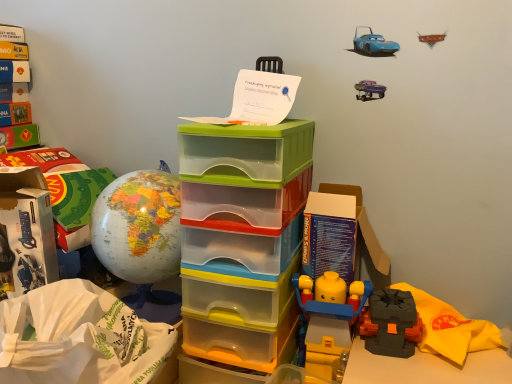
Question: From a real-world perspective, is matte black lego piece at lower right on top of translucent plastic storage box at center, positioned as the 2th storage box in left-to-right order?

Choices:
 (A) no
 (B) yes

Answer: (A)

Question: Is matte black lego piece at lower right to the left of translucent plastic storage box at center, positioned as the 2th storage box in left-to-right order, from the viewer's perspective?

Choices:
 (A) yes
 (B) no

Answer: (B)

Question: From a real-world perspective, is matte black lego piece at lower right positioned under translucent plastic storage box at center, arranged as the 1th storage box when viewed from the right, based on gravity?

Choices:
 (A) no
 (B) yes

Answer: (B)

Question: Is matte black lego piece at lower right thinner than translucent plastic storage box at center, arranged as the 1th storage box when viewed from the right?

Choices:
 (A) no
 (B) yes

Answer: (B)

Question: Would you say matte black lego piece at lower right is outside translucent plastic storage box at center, positioned as the 2th storage box in left-to-right order?

Choices:
 (A) yes
 (B) no

Answer: (A)

Question: Considering the positions of white cardboard box at left, marked as the second storage box in a right-to-left arrangement, and white paper bag at lower left in the image, is white cardboard box at left, marked as the second storage box in a right-to-left arrangement, bigger or smaller than white paper bag at lower left?

Choices:
 (A) big
 (B) small

Answer: (B)

Question: Is white cardboard box at left, marked as the second storage box in a right-to-left arrangement, in front of or behind white paper bag at lower left in the image?

Choices:
 (A) behind
 (B) front

Answer: (A)

Question: Does point (24, 195) appear closer or farther from the camera than point (136, 337)?

Choices:
 (A) farther
 (B) closer

Answer: (A)

Question: Is white cardboard box at left, which is the first storage box from left to right, inside the boundaries of white paper bag at lower left, or outside?

Choices:
 (A) outside
 (B) inside

Answer: (A)

Question: From a real-world perspective, is matte black lego piece at lower right physically located above or below white paper bag at lower left?

Choices:
 (A) below
 (B) above

Answer: (A)

Question: Is matte black lego piece at lower right to the left or to the right of white paper bag at lower left in the image?

Choices:
 (A) right
 (B) left

Answer: (A)

Question: Considering the positions of point (437, 304) and point (47, 349), is point (437, 304) closer or farther from the camera than point (47, 349)?

Choices:
 (A) farther
 (B) closer

Answer: (A)

Question: Is matte black lego piece at lower right spatially inside white paper bag at lower left, or outside of it?

Choices:
 (A) outside
 (B) inside

Answer: (A)

Question: In the image, is translucent plastic storage box at center, arranged as the 1th storage box when viewed from the right, on the left side or the right side of matte globe at left?

Choices:
 (A) right
 (B) left

Answer: (A)

Question: From their relative heights in the image, would you say translucent plastic storage box at center, positioned as the 2th storage box in left-to-right order, is taller or shorter than matte globe at left?

Choices:
 (A) tall
 (B) short

Answer: (A)